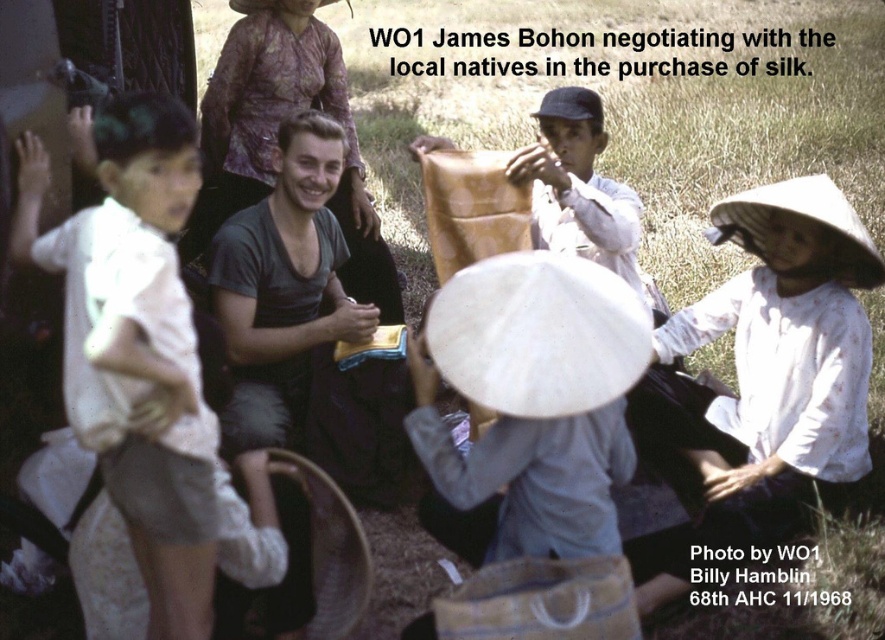
Question: Can you confirm if dark gray t-shirt at center is wider than light brown fabric at center?

Choices:
 (A) yes
 (B) no

Answer: (B)

Question: Is dark gray t-shirt at center to the right of light brown fabric at center from the viewer's perspective?

Choices:
 (A) yes
 (B) no

Answer: (B)

Question: Which object appears closest to the camera in this image?

Choices:
 (A) light brown fabric at center
 (B) printed silk dress at upper center

Answer: (A)

Question: Estimate the real-world distances between objects in this image. Which object is closer to the white cotton shirt at left?

Choices:
 (A) printed silk dress at upper center
 (B) dark gray t-shirt at center
 (C) light brown fabric at center

Answer: (B)

Question: Is white cotton shirt at left bigger than dark gray t-shirt at center?

Choices:
 (A) yes
 (B) no

Answer: (A)

Question: Which object is closer to the camera taking this photo?

Choices:
 (A) white cotton shirt at left
 (B) printed silk dress at upper center
 (C) dark gray t-shirt at center

Answer: (A)